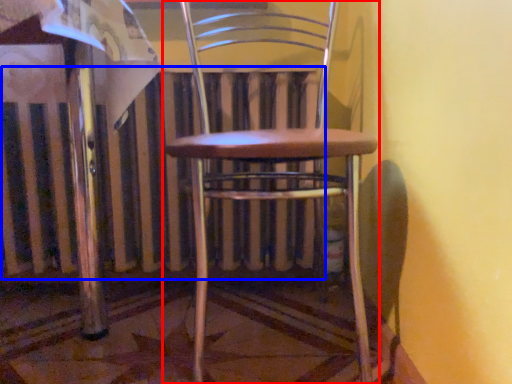
Question: Among these objects, which one is farthest to the camera, chair (highlighted by a red box) or radiator (highlighted by a blue box)?

Choices:
 (A) chair
 (B) radiator

Answer: (B)